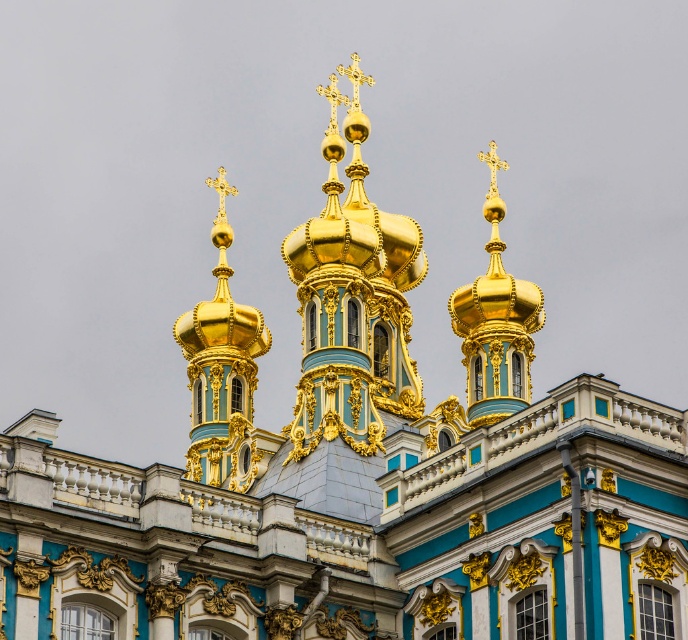
Is point (217, 454) farther from camera compared to point (541, 308)?

No, it is in front of (541, 308).

In the scene shown: Can you confirm if gold polished dome at upper left is positioned below gold polished dome at upper center?

Yes.

Identify the location of gold polished dome at upper left. (222, 371).

At what (x,y) coordinates should I click in order to perform the action: click on gold polished dome at upper left. Please return your answer as a coordinate pair (x, y). This screenshot has width=688, height=640. Looking at the image, I should click on (222, 371).